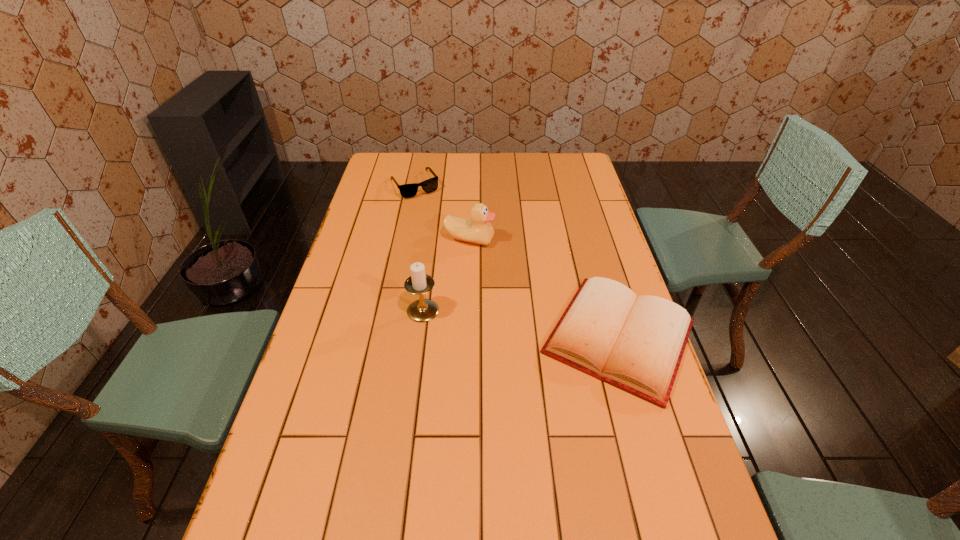
Where is `free space that is in between the third nearest object and the tallest object`? The image size is (960, 540). free space that is in between the third nearest object and the tallest object is located at coordinates pos(446,275).

Locate an element on the screen. Image resolution: width=960 pixels, height=540 pixels. empty space that is in between the second shortest object and the candle holder is located at coordinates (419, 248).

Locate an element on the screen. Image resolution: width=960 pixels, height=540 pixels. unoccupied position between the shortest object and the second shortest object is located at coordinates (516, 261).

Locate an element on the screen. Image resolution: width=960 pixels, height=540 pixels. empty space that is in between the Bible and the candle holder is located at coordinates (521, 323).

The height and width of the screenshot is (540, 960). Identify the location of vacant point located between the shortest object and the tallest object. (521, 323).

Locate an element on the screen. Image resolution: width=960 pixels, height=540 pixels. empty space that is in between the shortest object and the sunglasses is located at coordinates (516, 261).

Choose which object is the nearest neighbor to the candle holder. Please provide its 2D coordinates. Your answer should be formatted as a tuple, i.e. [(x, y)], where the tuple contains the x and y coordinates of a point satisfying the conditions above.

[(478, 230)]

Choose which object is the second nearest neighbor to the third nearest object. Please provide its 2D coordinates. Your answer should be formatted as a tuple, i.e. [(x, y)], where the tuple contains the x and y coordinates of a point satisfying the conditions above.

[(430, 185)]

You are a GUI agent. You are given a task and a screenshot of the screen. Output one action in this format:
    pyautogui.click(x=<x>, y=<y>)
    Task: Click on the free region that satisfies the following two spatial constraints: 1. on the front side of the tallest object; 2. on the left side of the sunglasses
    Image resolution: width=960 pixels, height=540 pixels.
    Given the screenshot: What is the action you would take?
    pyautogui.click(x=389, y=310)

You are a GUI agent. You are given a task and a screenshot of the screen. Output one action in this format:
    pyautogui.click(x=<x>, y=<y>)
    Task: Click on the vacant space that satisfies the following two spatial constraints: 1. on the front side of the rightmost object; 2. on the right side of the candle holder
    
    Given the screenshot: What is the action you would take?
    (x=420, y=337)